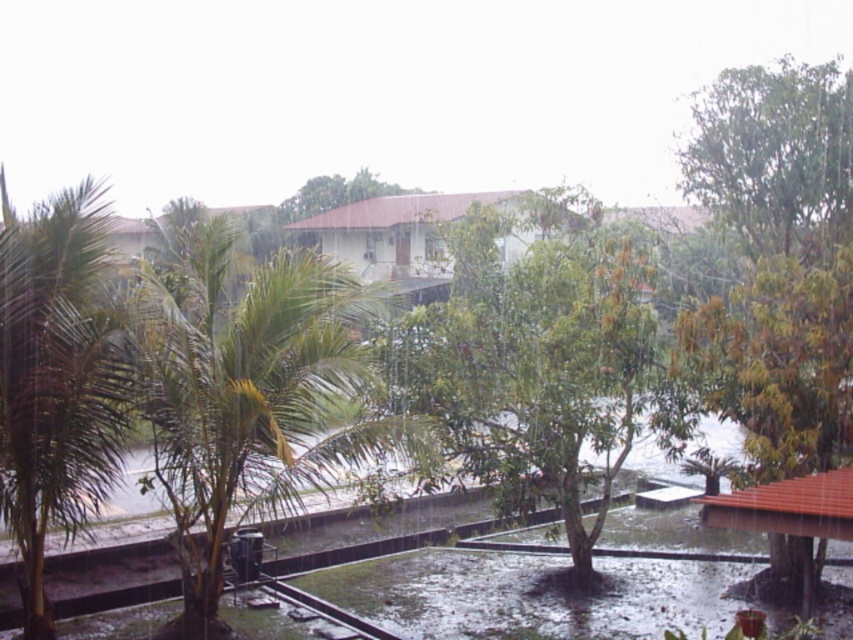
You are standing on the balcony and want to walk towards the building with the reddish brown tiled roof. There are two trees in the center of your view, a green leafy palm tree at center and a green leafy tree at center. Which tree should you walk around to stay on the paved pathway leading to the building?

You should walk around the green leafy palm tree at center to the left, as it is positioned to the left of the green leafy tree at center. This will keep you on the paved pathway leading to the building.

You are standing on the balcony and want to walk to the building with the reddish brown tiled roof. There are two trees in your way. How far apart are the green leafy tree at center and the green leafy palm tree at left?

The distance between the green leafy tree at center and the green leafy palm tree at left is 5.52 meters.